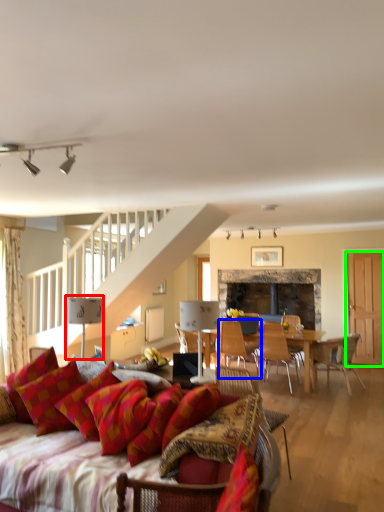
Question: Estimate the real-world distances between objects in this image. Which object is closer to lamp (highlighted by a red box), chair (highlighted by a blue box) or glass door (highlighted by a green box)?

Choices:
 (A) chair
 (B) glass door

Answer: (A)